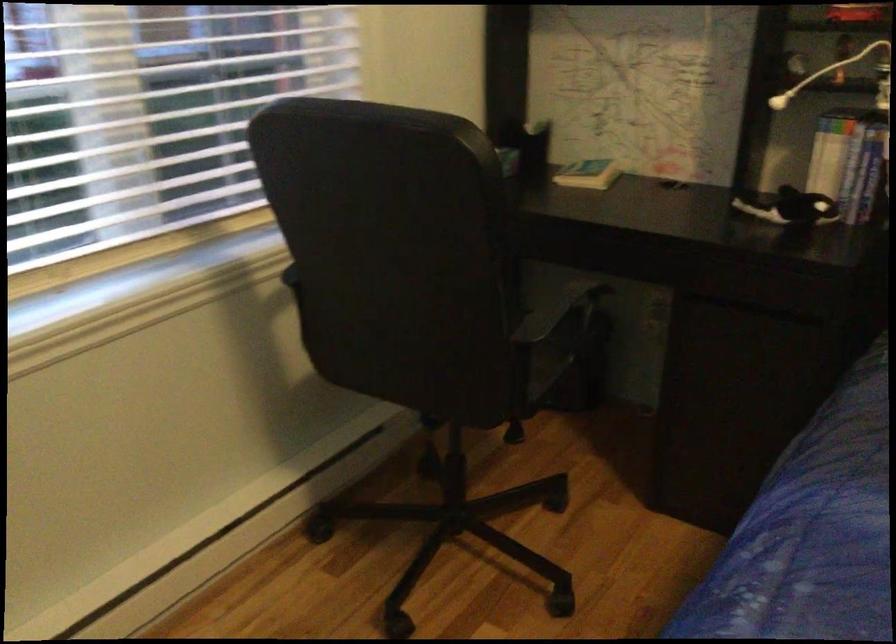
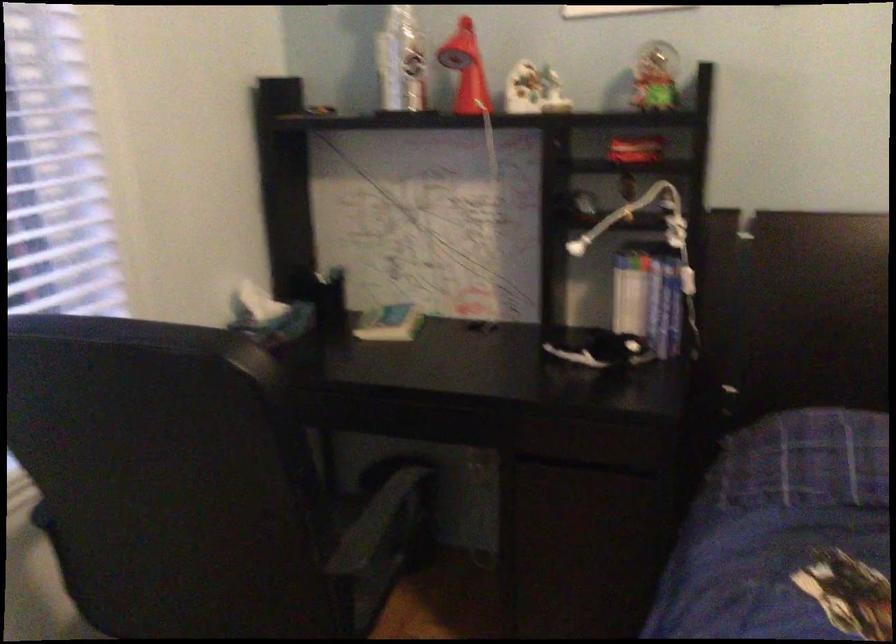
Find the pixel in the second image that matches point (825, 165) in the first image.

(629, 301)